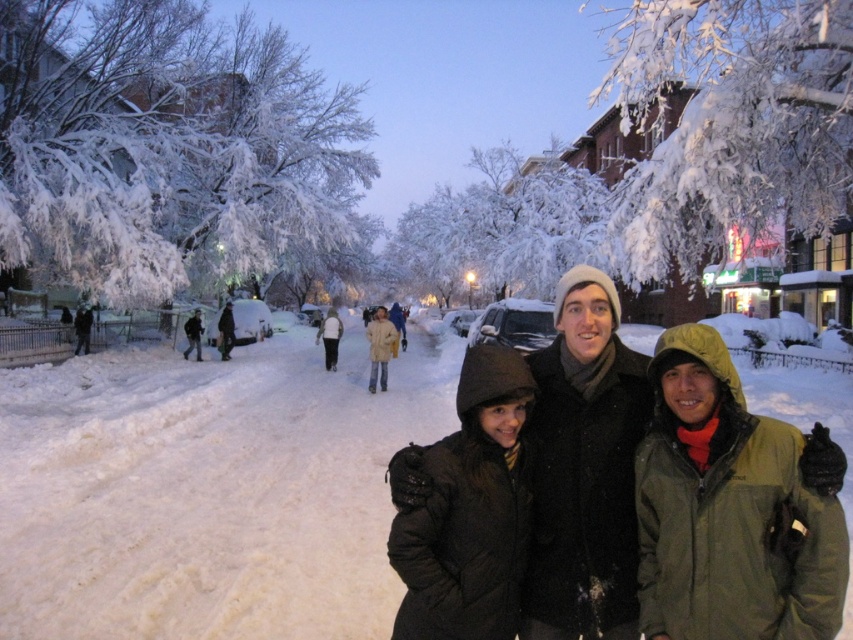
You are a pedestrian trying to decide which coat to wear for the evening walk. Both the dark brown jacket at center and the light brown fur coat at center are available. Based on their sizes, which one might be more suitable for carrying items like a bag or a thermos?

The light brown fur coat at center has a greater width than the dark brown jacket at center, making it more suitable for carrying items like a bag or thermos as it likely has more space.

You are standing at the bottom left corner of the image. You want to walk directly towards the dark brown jacket at center. In which direction should you move first?

Since the dark brown jacket at center is located at point 0.719 on the x axis and 0.674 on the y axis, you should move towards the right and slightly upwards to reach it.